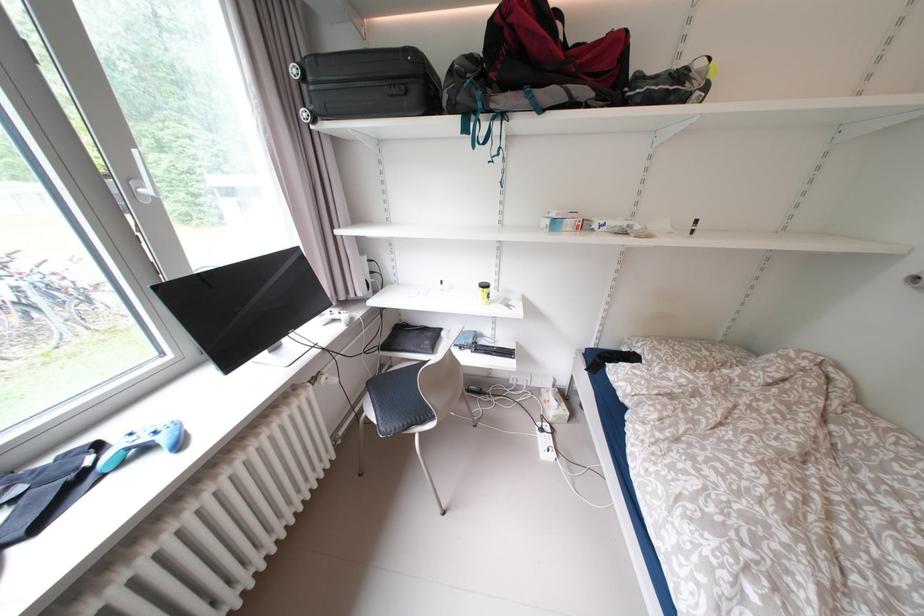
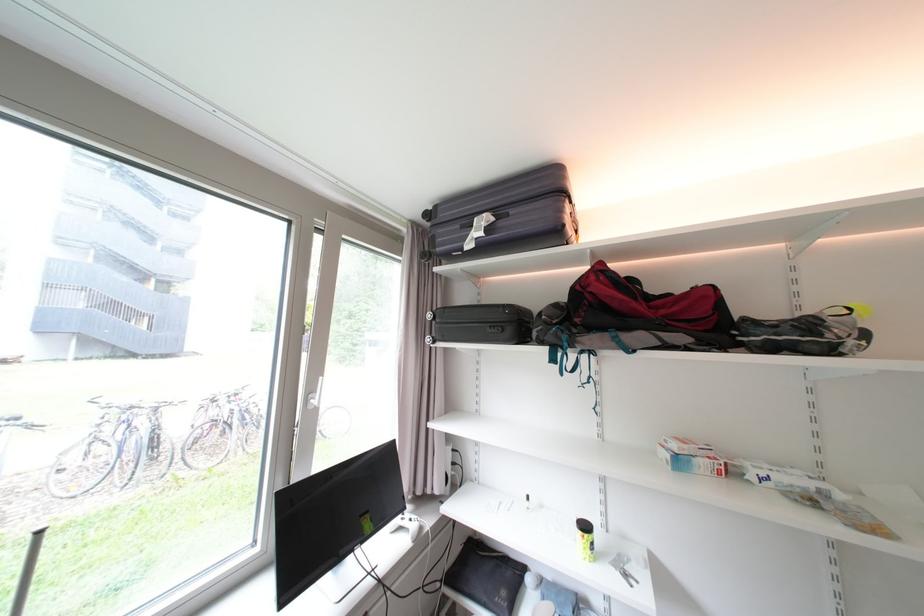
Locate, in the second image, the point that corresponds to (x=490, y=290) in the first image.

(589, 533)